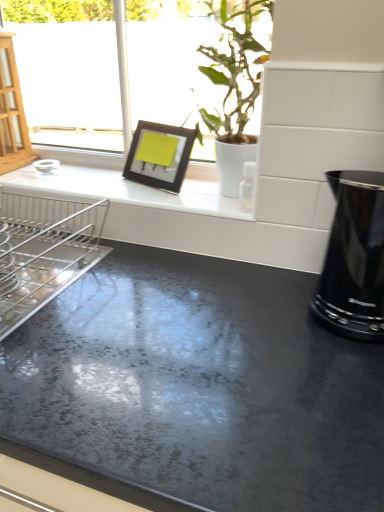
Question: Does silver metallic dish rack at left appear on the left side of black matte picture frame at upper center?

Choices:
 (A) no
 (B) yes

Answer: (B)

Question: Can you confirm if silver metallic dish rack at left is taller than black matte picture frame at upper center?

Choices:
 (A) yes
 (B) no

Answer: (B)

Question: From a real-world perspective, is silver metallic dish rack at left beneath black matte picture frame at upper center?

Choices:
 (A) no
 (B) yes

Answer: (B)

Question: Can we say silver metallic dish rack at left lies outside black matte picture frame at upper center?

Choices:
 (A) yes
 (B) no

Answer: (A)

Question: Considering the relative sizes of silver metallic dish rack at left and black matte picture frame at upper center in the image provided, is silver metallic dish rack at left shorter than black matte picture frame at upper center?

Choices:
 (A) yes
 (B) no

Answer: (A)

Question: Is black glossy kettle at right to the left or to the right of black matte picture frame at upper center in the image?

Choices:
 (A) left
 (B) right

Answer: (B)

Question: Looking at the image, does black glossy kettle at right seem bigger or smaller compared to black matte picture frame at upper center?

Choices:
 (A) big
 (B) small

Answer: (A)

Question: In terms of width, does black glossy kettle at right look wider or thinner when compared to black matte picture frame at upper center?

Choices:
 (A) wide
 (B) thin

Answer: (A)

Question: From the image's perspective, relative to black matte picture frame at upper center, is black glossy kettle at right above or below?

Choices:
 (A) below
 (B) above

Answer: (A)

Question: Is black matte picture frame at upper center taller or shorter than silver metallic dish rack at left?

Choices:
 (A) tall
 (B) short

Answer: (A)

Question: Is black matte picture frame at upper center situated inside silver metallic dish rack at left or outside?

Choices:
 (A) inside
 (B) outside

Answer: (B)

Question: From a real-world perspective, is black matte picture frame at upper center above or below silver metallic dish rack at left?

Choices:
 (A) above
 (B) below

Answer: (A)

Question: Is black matte picture frame at upper center to the left or to the right of silver metallic dish rack at left in the image?

Choices:
 (A) left
 (B) right

Answer: (B)

Question: Is white glossy countertop at upper center in front of or behind green leafy plant at upper center in the image?

Choices:
 (A) front
 (B) behind

Answer: (B)

Question: From a real-world perspective, is white glossy countertop at upper center above or below green leafy plant at upper center?

Choices:
 (A) below
 (B) above

Answer: (A)